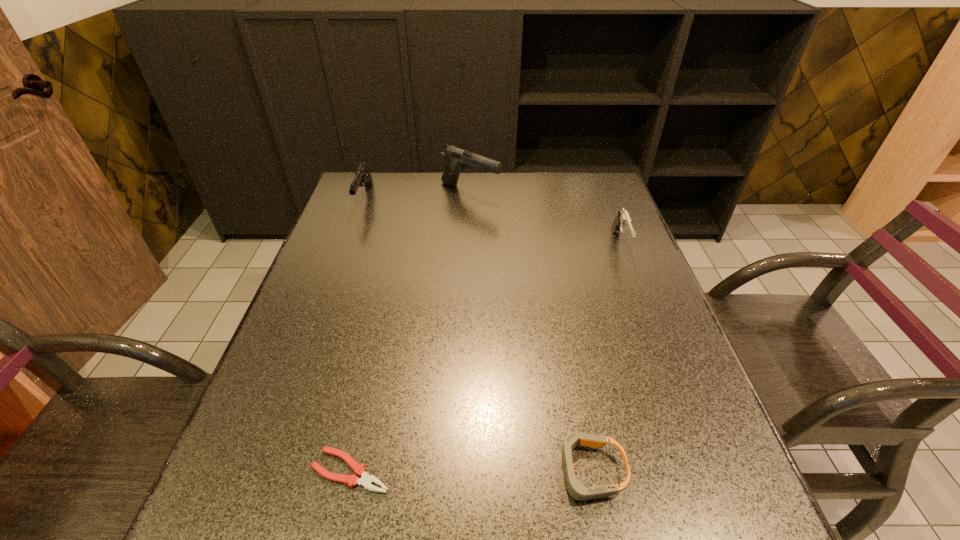
You are a GUI agent. You are given a task and a screenshot of the screen. Output one action in this format:
    pyautogui.click(x=<x>, y=<y>)
    Task: Click on the vacant area that lies between the fourth tallest object and the nearest gun
    
    Given the screenshot: What is the action you would take?
    pyautogui.click(x=605, y=358)

You are a GUI agent. You are given a task and a screenshot of the screen. Output one action in this format:
    pyautogui.click(x=<x>, y=<y>)
    Task: Click on the free space between the leftmost gun and the tallest gun
    This screenshot has width=960, height=540.
    Given the screenshot: What is the action you would take?
    pyautogui.click(x=418, y=196)

This screenshot has height=540, width=960. I want to click on empty space between the second object from right to left and the pliers, so click(470, 471).

Find the location of a particular element. Image resolution: width=960 pixels, height=540 pixels. free point between the leftmost gun and the rightmost object is located at coordinates (x=492, y=222).

Image resolution: width=960 pixels, height=540 pixels. What are the coordinates of `free space between the leftmost object and the second object from right to left` in the screenshot? It's located at (477, 335).

I want to click on object that is the third closest to the tallest object, so click(576, 489).

At what (x,y) coordinates should I click in order to perform the action: click on the fourth closest object to the second gun from left to right. Please return your answer as a coordinate pair (x, y). Looking at the image, I should click on (366, 480).

This screenshot has height=540, width=960. In order to click on gun that is the second nearest to the leftmost object in this screenshot , I will do `click(622, 223)`.

This screenshot has height=540, width=960. In order to click on gun identified as the closest to the rightmost object in this screenshot , I will do `click(457, 159)`.

Locate an element on the screen. vacant space that satisfies the following two spatial constraints: 1. at the muzzle of the third object from right to left; 2. at the end of the barrel of the leftmost gun is located at coordinates (469, 200).